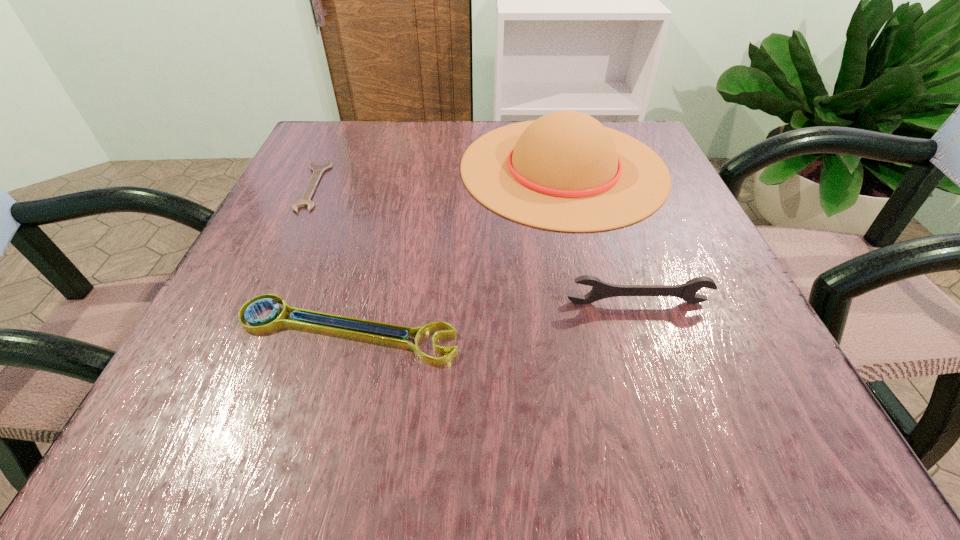
I want to click on object that can be found as the second closest to the sombrero, so click(x=600, y=290).

Where is `the second closest object relative to the sombrero`? This screenshot has width=960, height=540. the second closest object relative to the sombrero is located at coordinates (600, 290).

Image resolution: width=960 pixels, height=540 pixels. In order to click on wrench that is the closest to the tallest wrench in this screenshot , I will do `click(275, 320)`.

Identify the location of wrench that is the second closest to the tallest object. This screenshot has width=960, height=540. (600, 290).

This screenshot has height=540, width=960. I want to click on free space that satisfies the following two spatial constraints: 1. on the back side of the sombrero; 2. on the left side of the farthest wrench, so click(x=322, y=167).